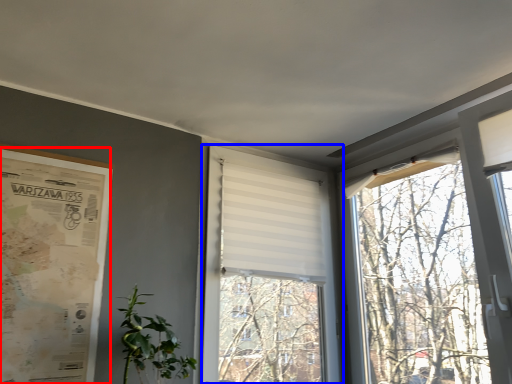
Question: Which object is further to the camera taking this photo, poster page (highlighted by a red box) or window (highlighted by a blue box)?

Choices:
 (A) poster page
 (B) window

Answer: (B)